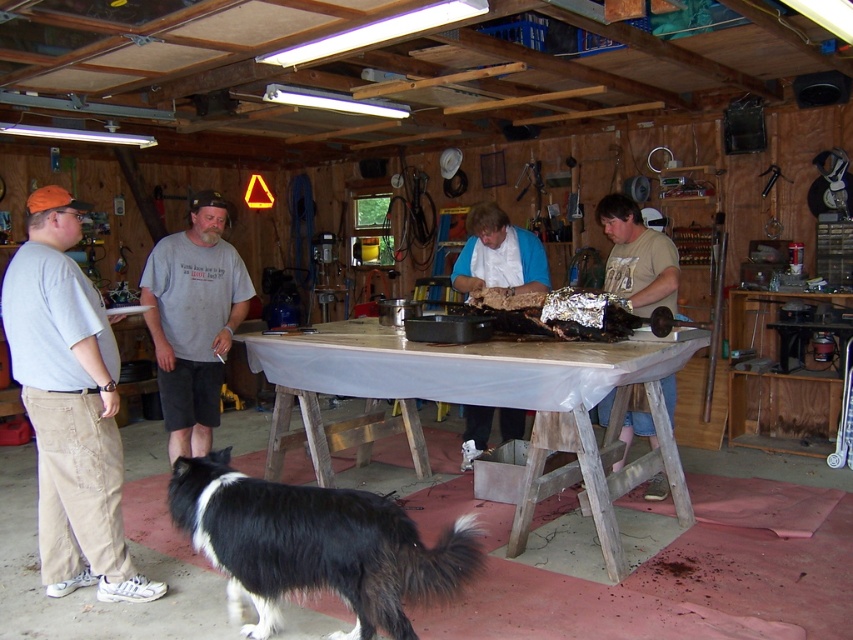
Between point (292, 384) and point (543, 256), which one is positioned behind?

The point (543, 256) is more distant.

Based on the photo, who is shorter, wooden table at center or blue fabric shirt at center?

Standing shorter between the two is blue fabric shirt at center.

Does point (305, 364) come farther from viewer compared to point (490, 209)?

No, it is in front of (490, 209).

I want to click on wooden table at center, so click(486, 401).

Between wooden table at center and black and white fur at lower left, which one is positioned higher?

wooden table at center is higher up.

Is point (624, 481) less distant than point (409, 582)?

No.

Identify the location of wooden table at center. (486, 401).

Between gray cotton shirt at center and blue fabric shirt at center, which one has more height?

gray cotton shirt at center

Measure the distance between gray cotton shirt at center and camera.

gray cotton shirt at center is 12.64 feet from camera.

Where is `gray cotton shirt at center`? Image resolution: width=853 pixels, height=640 pixels. gray cotton shirt at center is located at coordinates (193, 321).